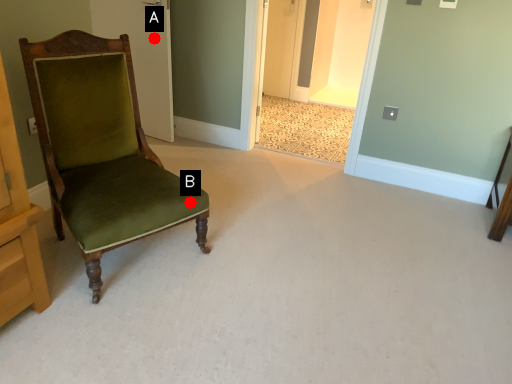
Question: Two points are circled on the image, labeled by A and B beside each circle. Which point is closer to the camera taking this photo?

Choices:
 (A) A is closer
 (B) B is closer

Answer: (B)